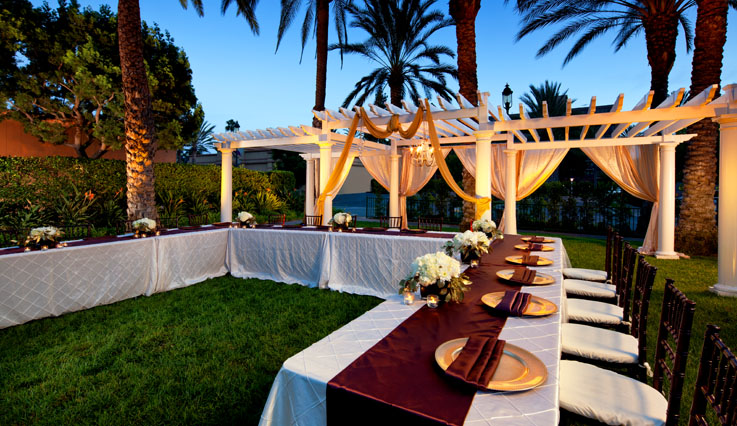
Find the location of a particular element. The width and height of the screenshot is (737, 426). columns is located at coordinates (660, 207), (506, 220), (477, 159), (393, 183), (307, 190), (223, 192), (726, 167).